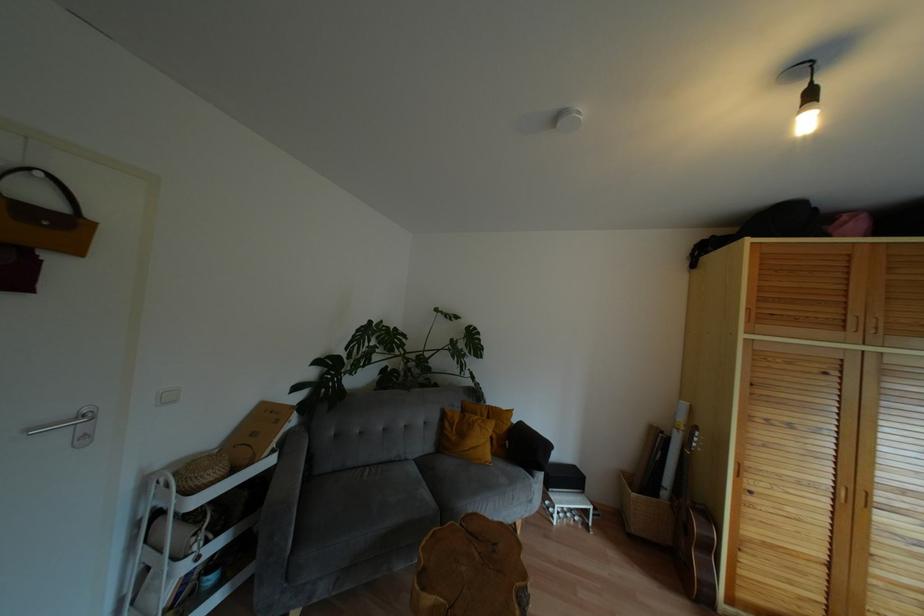
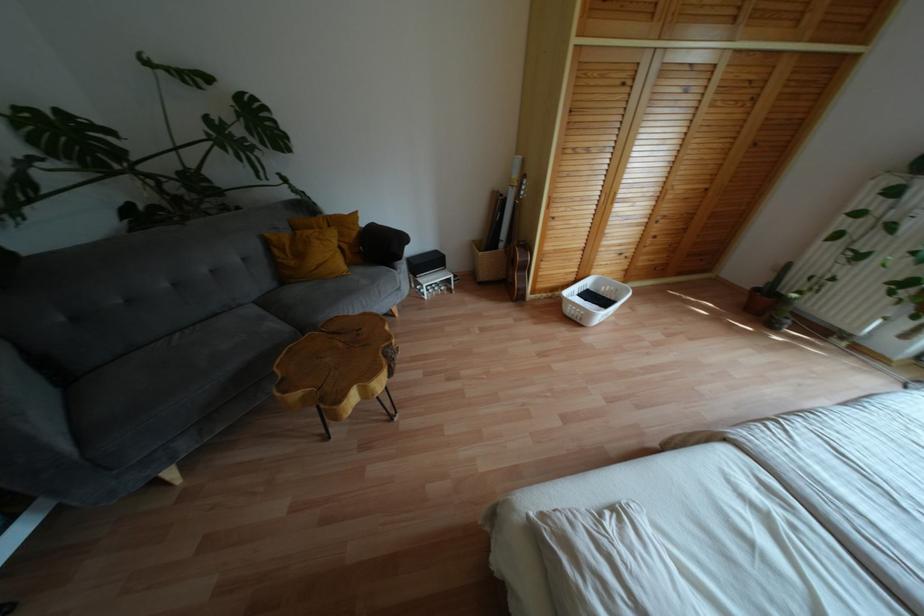
In the second image, find the point that corresponds to point (477, 554) in the first image.

(341, 344)